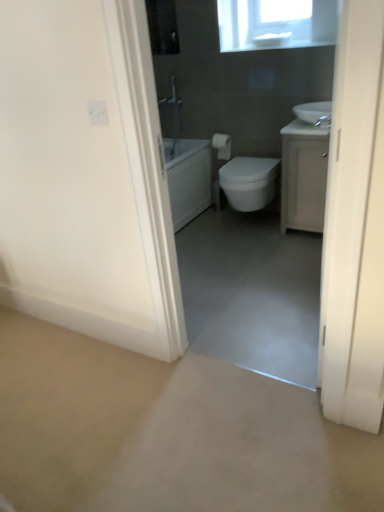
I want to click on vacant space situated above white glossy bidet at center (from a real-world perspective), so click(244, 166).